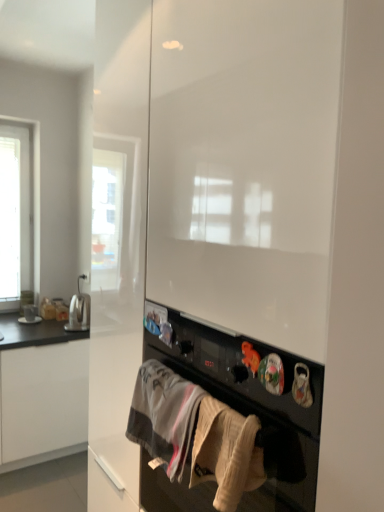
The image size is (384, 512). Describe the element at coordinates (226, 453) in the screenshot. I see `beige cotton towel at lower center, which is counted as the second clothing, starting from the back` at that location.

Locate an element on the screen. The image size is (384, 512). beige cotton towel at lower center, which is the first clothing from right to left is located at coordinates (226, 453).

Find the location of a particular element. The width and height of the screenshot is (384, 512). white glossy cabinet at left is located at coordinates (41, 392).

Describe the element at coordinates (79, 313) in the screenshot. I see `satin silver toaster at left` at that location.

Locate an element on the screen. The height and width of the screenshot is (512, 384). beige cotton towel at lower center, which is the first clothing from right to left is located at coordinates (226, 453).

Is beige cotton towel at lower center, which appears as the first clothing when viewed from the front, positioned beyond the bounds of black matte oven at center?

That's incorrect, beige cotton towel at lower center, which appears as the first clothing when viewed from the front, is not completely outside black matte oven at center.

Is beige cotton towel at lower center, which is counted as the second clothing, starting from the back, next to black matte oven at center?

They are not placed beside each other.

You are a GUI agent. You are given a task and a screenshot of the screen. Output one action in this format:
    pyautogui.click(x=<x>, y=<y>)
    Task: Click on the 2nd clothing positioned above the black matte oven at center (from a real-world perspective)
    The image size is (384, 512).
    Given the screenshot: What is the action you would take?
    pyautogui.click(x=226, y=453)

Consider the image. Is beige cotton towel at lower center, acting as the second clothing starting from the left, oriented away from black matte oven at center?

Yes.

The height and width of the screenshot is (512, 384). I want to click on the 1st clothing behind the black matte oven at center, so click(x=226, y=453).

From a real-world perspective, which is physically above, black matte oven at center or beige cotton towel at lower center, which is the first clothing from right to left?

From a 3D spatial view, beige cotton towel at lower center, which is the first clothing from right to left, is above.

Could you tell me if black matte oven at center is turned towards beige cotton towel at lower center, acting as the second clothing starting from the left?

Yes, black matte oven at center is turned towards beige cotton towel at lower center, acting as the second clothing starting from the left.

From the image's perspective, which one is positioned lower, black matte oven at center or beige cotton towel at lower center, which appears as the first clothing when viewed from the front?

From the image's view, black matte oven at center is below.

Is white cotton towel at lower center, acting as the second clothing starting from the right, inside the boundaries of black matte oven at center, or outside?

white cotton towel at lower center, acting as the second clothing starting from the right, lies outside black matte oven at center.

How different are the orientations of white cotton towel at lower center, which appears as the 1th clothing when viewed from the left, and black matte oven at center in degrees?

0.754 degrees separate the facing orientations of white cotton towel at lower center, which appears as the 1th clothing when viewed from the left, and black matte oven at center.

Is white cotton towel at lower center, the 1th clothing in the back-to-front sequence, thinner than black matte oven at center?

Correct, the width of white cotton towel at lower center, the 1th clothing in the back-to-front sequence, is less than that of black matte oven at center.

From a real-world perspective, is white cotton towel at lower center, the 1th clothing in the back-to-front sequence, positioned above or below black matte oven at center?

white cotton towel at lower center, the 1th clothing in the back-to-front sequence, is situated higher than black matte oven at center in the real world.

Based on their sizes in the image, would you say white glossy cabinet at left is bigger or smaller than white cotton towel at lower center, marked as the 2th clothing in a front-to-back arrangement?

Considering their sizes, white glossy cabinet at left takes up more space than white cotton towel at lower center, marked as the 2th clothing in a front-to-back arrangement.

Considering the relative positions of white glossy cabinet at left and white cotton towel at lower center, which appears as the 1th clothing when viewed from the left, in the image provided, is white glossy cabinet at left to the left of white cotton towel at lower center, which appears as the 1th clothing when viewed from the left, from the viewer's perspective?

Yes.

From a real-world perspective, is white glossy cabinet at left beneath white cotton towel at lower center, the 1th clothing in the back-to-front sequence?

Indeed, from a real-world perspective, white glossy cabinet at left is positioned beneath white cotton towel at lower center, the 1th clothing in the back-to-front sequence.

Can you confirm if white glossy cabinet at left is shorter than white cotton towel at lower center, the 1th clothing in the back-to-front sequence?

In fact, white glossy cabinet at left may be taller than white cotton towel at lower center, the 1th clothing in the back-to-front sequence.

Is beige cotton towel at lower center, acting as the second clothing starting from the left, situated inside white glossy cabinet at left or outside?

beige cotton towel at lower center, acting as the second clothing starting from the left, is outside white glossy cabinet at left.

Is beige cotton towel at lower center, acting as the second clothing starting from the left, further to camera compared to white glossy cabinet at left?

No.

Who is shorter, beige cotton towel at lower center, which is counted as the second clothing, starting from the back, or white glossy cabinet at left?

With less height is beige cotton towel at lower center, which is counted as the second clothing, starting from the back.

From the image's perspective, is beige cotton towel at lower center, which is counted as the second clothing, starting from the back, positioned above or below white glossy cabinet at left?

From the image's perspective, beige cotton towel at lower center, which is counted as the second clothing, starting from the back, appears above white glossy cabinet at left.

From a real-world perspective, is white cotton towel at lower center, the 1th clothing in the back-to-front sequence, physically located above or below satin silver toaster at left?

From a real-world perspective, white cotton towel at lower center, the 1th clothing in the back-to-front sequence, is physically above satin silver toaster at left.

Could you tell me if white cotton towel at lower center, the 1th clothing in the back-to-front sequence, is turned towards satin silver toaster at left?

No, white cotton towel at lower center, the 1th clothing in the back-to-front sequence, does not turn towards satin silver toaster at left.

Are white cotton towel at lower center, marked as the 2th clothing in a front-to-back arrangement, and satin silver toaster at left making contact?

No, white cotton towel at lower center, marked as the 2th clothing in a front-to-back arrangement, is not touching satin silver toaster at left.

Between white cotton towel at lower center, the 1th clothing in the back-to-front sequence, and satin silver toaster at left, which one has smaller size?

white cotton towel at lower center, the 1th clothing in the back-to-front sequence.

Considering the points (75, 313) and (28, 464), which point is in front, point (75, 313) or point (28, 464)?

The point (28, 464) is more forward.

Which object is positioned more to the right, satin silver toaster at left or white glossy cabinet at left?

Positioned to the right is satin silver toaster at left.

Does satin silver toaster at left have a greater width compared to white glossy cabinet at left?

Incorrect, the width of satin silver toaster at left does not surpass that of white glossy cabinet at left.

From the image's perspective, relative to white glossy cabinet at left, is satin silver toaster at left above or below?

Clearly, from the image's perspective, satin silver toaster at left is above white glossy cabinet at left.

This screenshot has height=512, width=384. What are the coordinates of `the 1st clothing counting from the left side of the black matte oven at center` in the screenshot? It's located at (226, 453).

The width and height of the screenshot is (384, 512). Identify the location of home appliance that appears on the right of beige cotton towel at lower center, acting as the second clothing starting from the left. (252, 405).

Which object lies nearer to the anchor point satin silver toaster at left, black matte oven at center or beige cotton towel at lower center, which appears as the first clothing when viewed from the front?

Among the two, black matte oven at center is located nearer to satin silver toaster at left.

Considering their positions, is beige cotton towel at lower center, which is the first clothing from right to left, positioned further to white cotton towel at lower center, the 1th clothing in the back-to-front sequence, than white glossy cabinet at left?

white glossy cabinet at left is further to white cotton towel at lower center, the 1th clothing in the back-to-front sequence.

When comparing their distances from black matte oven at center, does satin silver toaster at left or white glossy cabinet at left seem closer?

white glossy cabinet at left.

Looking at the image, which one is located further to white cotton towel at lower center, marked as the 2th clothing in a front-to-back arrangement, satin silver toaster at left or beige cotton towel at lower center, which is the first clothing from right to left?

satin silver toaster at left.

Based on their spatial positions, is black matte oven at center or satin silver toaster at left closer to beige cotton towel at lower center, which is the first clothing from right to left?

Based on the image, black matte oven at center appears to be nearer to beige cotton towel at lower center, which is the first clothing from right to left.

Estimate the real-world distances between objects in this image. Which object is closer to satin silver toaster at left, white cotton towel at lower center, the 1th clothing in the back-to-front sequence, or black matte oven at center?

Among the two, white cotton towel at lower center, the 1th clothing in the back-to-front sequence, is located nearer to satin silver toaster at left.

Which object lies nearer to the anchor point satin silver toaster at left, white glossy cabinet at left or beige cotton towel at lower center, acting as the second clothing starting from the left?

The object closer to satin silver toaster at left is white glossy cabinet at left.

When comparing their distances from beige cotton towel at lower center, which is counted as the second clothing, starting from the back, does satin silver toaster at left or white cotton towel at lower center, marked as the 2th clothing in a front-to-back arrangement, seem closer?

white cotton towel at lower center, marked as the 2th clothing in a front-to-back arrangement, lies closer to beige cotton towel at lower center, which is counted as the second clothing, starting from the back, than the other object.

Identify the location of clothing located between beige cotton towel at lower center, which is the first clothing from right to left, and satin silver toaster at left in the depth direction. click(164, 416).

This screenshot has width=384, height=512. I want to click on cabinetry between black matte oven at center and satin silver toaster at left from front to back, so click(x=41, y=392).

Where is `cabinetry between white cotton towel at lower center, acting as the second clothing starting from the right, and satin silver toaster at left from front to back`? cabinetry between white cotton towel at lower center, acting as the second clothing starting from the right, and satin silver toaster at left from front to back is located at coordinates (41, 392).

I want to click on cabinetry between beige cotton towel at lower center, which is counted as the second clothing, starting from the back, and satin silver toaster at left, along the z-axis, so click(41, 392).